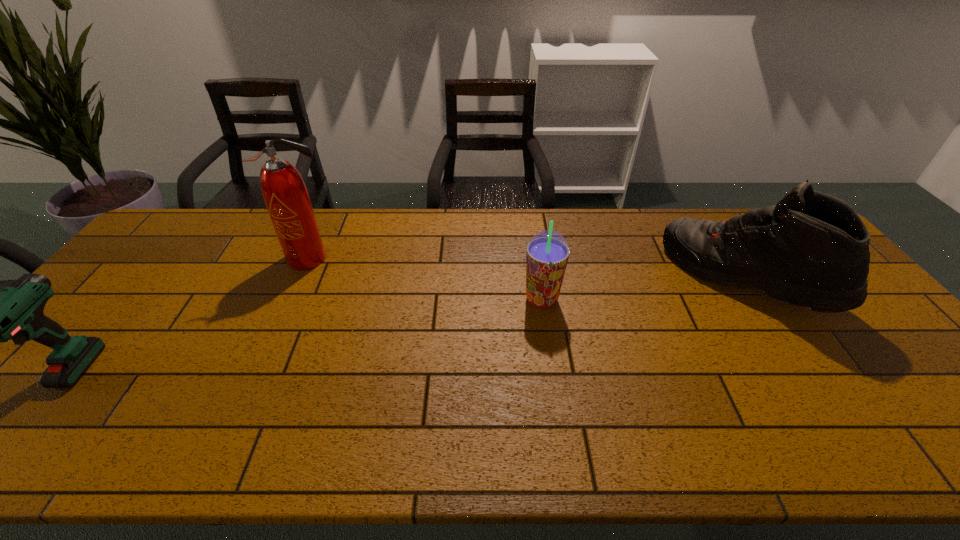
In order to click on the third object from right to left in this screenshot , I will do `click(284, 192)`.

This screenshot has height=540, width=960. I want to click on the tallest object, so click(x=284, y=192).

At what (x,y) coordinates should I click in order to perform the action: click on the rightmost object. Please return your answer as a coordinate pair (x, y). Looking at the image, I should click on (812, 249).

At what (x,y) coordinates should I click in order to perform the action: click on ski boot. Please return your answer as a coordinate pair (x, y). This screenshot has width=960, height=540. Looking at the image, I should click on (812, 249).

This screenshot has height=540, width=960. Find the location of `the second object from right to left`. the second object from right to left is located at coordinates (547, 254).

Locate an element on the screen. The width and height of the screenshot is (960, 540). free space located on the right of the tallest object is located at coordinates (450, 259).

This screenshot has height=540, width=960. Find the location of `blank space located 0.150m on the left of the ski boot`. blank space located 0.150m on the left of the ski boot is located at coordinates (625, 278).

Locate an element on the screen. Image resolution: width=960 pixels, height=540 pixels. vacant space located on the left of the third object from left to right is located at coordinates (500, 300).

Locate an element on the screen. Image resolution: width=960 pixels, height=540 pixels. fire extinguisher located in the far edge section of the desktop is located at coordinates (284, 192).

Where is `ski boot at the far edge`? ski boot at the far edge is located at coordinates (812, 249).